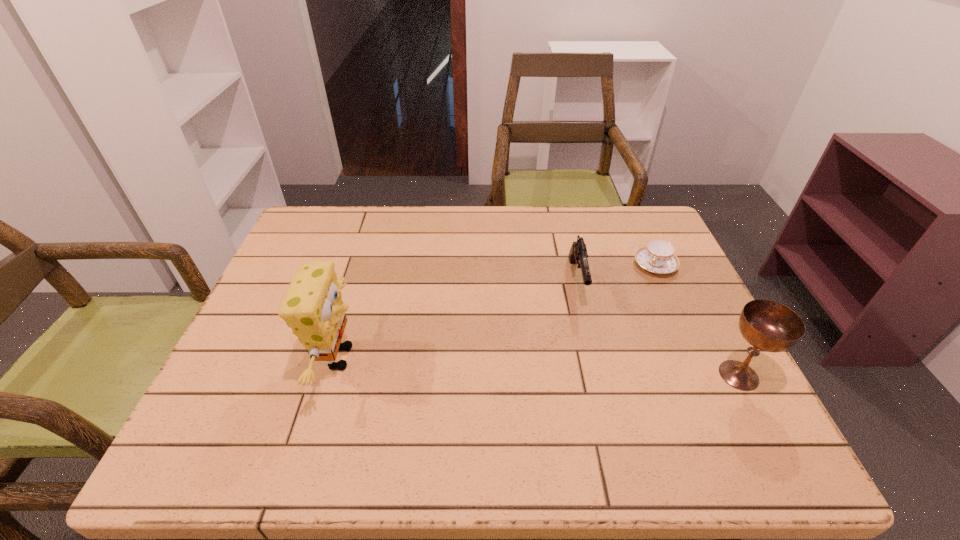
Locate an element on the screen. The height and width of the screenshot is (540, 960). vacant space that satisfies the following two spatial constraints: 1. on the front side of the second tallest object; 2. on the left side of the second shortest object is located at coordinates (600, 375).